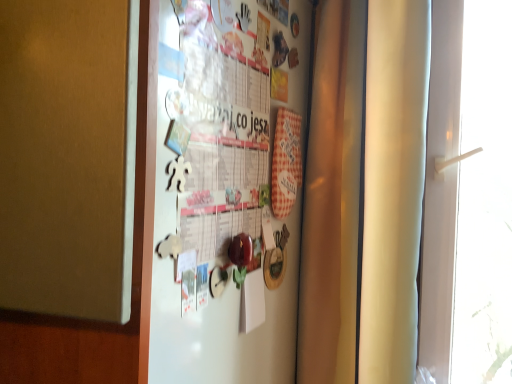
Question: Should I look upward or downward to see white paperboard fridge at center?

Choices:
 (A) down
 (B) up

Answer: (B)

Question: From a real-world perspective, does white plastic handle at right sit lower than white paperboard fridge at center?

Choices:
 (A) yes
 (B) no

Answer: (A)

Question: Is white plastic handle at right facing towards white paperboard fridge at center?

Choices:
 (A) no
 (B) yes

Answer: (A)

Question: Is white plastic handle at right with white paperboard fridge at center?

Choices:
 (A) no
 (B) yes

Answer: (A)

Question: Can you confirm if white plastic handle at right is positioned to the right of white paperboard fridge at center?

Choices:
 (A) no
 (B) yes

Answer: (B)

Question: From a real-world perspective, is white plastic handle at right physically above white paperboard fridge at center?

Choices:
 (A) yes
 (B) no

Answer: (B)

Question: Is the depth of white plastic handle at right less than that of white paperboard fridge at center?

Choices:
 (A) no
 (B) yes

Answer: (A)

Question: Is white paperboard fridge at center in front of white plastic handle at right?

Choices:
 (A) yes
 (B) no

Answer: (A)

Question: Can you confirm if white paperboard fridge at center is taller than white plastic handle at right?

Choices:
 (A) yes
 (B) no

Answer: (B)

Question: Could you tell me if white paperboard fridge at center is turned towards white plastic handle at right?

Choices:
 (A) no
 (B) yes

Answer: (A)

Question: Is white paperboard fridge at center positioned beyond the bounds of white plastic handle at right?

Choices:
 (A) no
 (B) yes

Answer: (B)

Question: From a real-world perspective, is white paperboard fridge at center positioned under white plastic handle at right based on gravity?

Choices:
 (A) yes
 (B) no

Answer: (B)

Question: Is white paperboard fridge at center surrounding white plastic handle at right?

Choices:
 (A) yes
 (B) no

Answer: (B)

Question: From the image's perspective, relative to white paperboard fridge at center, is white plastic handle at right above or below?

Choices:
 (A) above
 (B) below

Answer: (B)